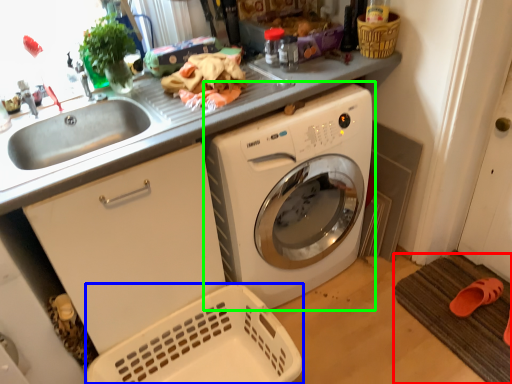
Question: Estimate the real-world distances between objects in this image. Which object is closer to bath mat (highlighted by a red box), basket (highlighted by a blue box) or washing machine (highlighted by a green box)?

Choices:
 (A) basket
 (B) washing machine

Answer: (B)